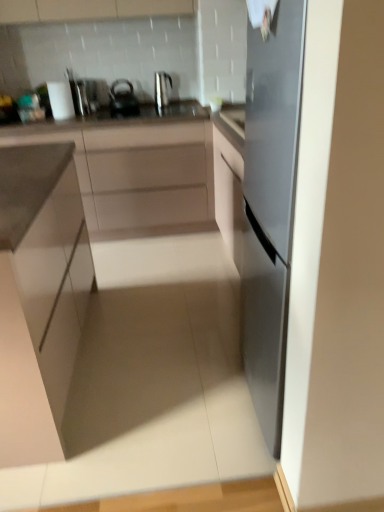
Where is `matte black kettle at upper center`? matte black kettle at upper center is located at coordinates (123, 99).

This screenshot has width=384, height=512. Find the location of `satin silver toaster at upper left`. satin silver toaster at upper left is located at coordinates (78, 95).

Locate an element on the screen. Image resolution: width=384 pixels, height=512 pixels. white matte cabinet at center, which is the second cabinetry in front-to-back order is located at coordinates (136, 172).

Locate an element on the screen. This screenshot has width=384, height=512. metallic silver kettle at upper center is located at coordinates (161, 89).

Is point (80, 170) positioned behind point (67, 68)?

No, (80, 170) is in front of (67, 68).

Is white matte cabinet at center, which is the second cabinetry in front-to-back order, smaller than satin silver toaster at upper left?

Incorrect, white matte cabinet at center, which is the second cabinetry in front-to-back order, is not smaller in size than satin silver toaster at upper left.

Is white matte cabinet at center, which is the first cabinetry from back to front, directly adjacent to satin silver toaster at upper left?

No, white matte cabinet at center, which is the first cabinetry from back to front, is not next to satin silver toaster at upper left.

The width and height of the screenshot is (384, 512). Identify the location of appliance above the white matte cabinet at center, which is the second cabinetry in front-to-back order (from a real-world perspective). point(78,95).

Can you see matte black kettle at upper center touching satin silver toaster at upper left?

matte black kettle at upper center and satin silver toaster at upper left are not in contact.

Between matte black kettle at upper center and satin silver toaster at upper left, which one has smaller width?

satin silver toaster at upper left is thinner.

You are a GUI agent. You are given a task and a screenshot of the screen. Output one action in this format:
    pyautogui.click(x=<x>, y=<y>)
    Task: Click on the appliance that is above the matte black kettle at upper center (from the image's perspective)
    
    Given the screenshot: What is the action you would take?
    pyautogui.click(x=78, y=95)

Is matte black kettle at upper center surrounding satin silver toaster at upper left?

No, satin silver toaster at upper left is not inside matte black kettle at upper center.

Is metallic silver kettle at upper center not inside white matte cabinet at center, which is the second cabinetry in front-to-back order?

metallic silver kettle at upper center lies outside white matte cabinet at center, which is the second cabinetry in front-to-back order,'s area.

Is metallic silver kettle at upper center taller than white matte cabinet at center, which is the second cabinetry in front-to-back order?

Incorrect, the height of metallic silver kettle at upper center is not larger of that of white matte cabinet at center, which is the second cabinetry in front-to-back order.

Which is in front, metallic silver kettle at upper center or white matte cabinet at center, which is the first cabinetry from back to front?

white matte cabinet at center, which is the first cabinetry from back to front, is in front.

From the image's perspective, which is above, metallic silver kettle at upper center or white matte cabinet at center, which is the second cabinetry in front-to-back order?

metallic silver kettle at upper center appears higher in the image.

Is matte white cabinet at left, the 2th cabinetry when ordered from back to front, completely or partially inside satin silver toaster at upper left?

Definitely not — matte white cabinet at left, the 2th cabinetry when ordered from back to front, is not inside satin silver toaster at upper left.

From the image's perspective, is satin silver toaster at upper left on matte white cabinet at left, the 2th cabinetry when ordered from back to front?

Indeed, from the image's perspective, satin silver toaster at upper left is shown above matte white cabinet at left, the 2th cabinetry when ordered from back to front.

How distant is satin silver toaster at upper left from matte white cabinet at left, the 2th cabinetry when ordered from back to front?

satin silver toaster at upper left and matte white cabinet at left, the 2th cabinetry when ordered from back to front, are 5.15 feet apart.

Is satin silver toaster at upper left positioned far away from matte white cabinet at left, the 2th cabinetry when ordered from back to front?

Yes.

Does point (69, 354) come farther from viewer compared to point (155, 72)?

No.

From a real-world perspective, which is physically below, matte white cabinet at left, the 2th cabinetry when ordered from back to front, or metallic silver kettle at upper center?

In real-world perspective, matte white cabinet at left, the 2th cabinetry when ordered from back to front, is lower.

Is matte white cabinet at left, which appears as the 1th cabinetry when viewed from the front, bigger than metallic silver kettle at upper center?

Indeed, matte white cabinet at left, which appears as the 1th cabinetry when viewed from the front, has a larger size compared to metallic silver kettle at upper center.

Would you say metallic silver kettle at upper center is part of matte white cabinet at left, the 2th cabinetry when ordered from back to front,'s contents?

Definitely not — metallic silver kettle at upper center is not inside matte white cabinet at left, the 2th cabinetry when ordered from back to front.

Is white matte cabinet at center, which is the first cabinetry from back to front, facing away from matte black kettle at upper center?

white matte cabinet at center, which is the first cabinetry from back to front, is not turned away from matte black kettle at upper center.

Could you measure the distance between white matte cabinet at center, which is the first cabinetry from back to front, and matte black kettle at upper center?

A distance of 55.62 centimeters exists between white matte cabinet at center, which is the first cabinetry from back to front, and matte black kettle at upper center.

Which of these two, white matte cabinet at center, which is the second cabinetry in front-to-back order, or matte black kettle at upper center, stands taller?

white matte cabinet at center, which is the second cabinetry in front-to-back order.

Considering the sizes of objects white matte cabinet at center, which is the second cabinetry in front-to-back order, and matte black kettle at upper center in the image provided, who is wider, white matte cabinet at center, which is the second cabinetry in front-to-back order, or matte black kettle at upper center?

white matte cabinet at center, which is the second cabinetry in front-to-back order.

Where is `cabinetry behind the matte white cabinet at left, the 2th cabinetry when ordered from back to front`? The height and width of the screenshot is (512, 384). cabinetry behind the matte white cabinet at left, the 2th cabinetry when ordered from back to front is located at coordinates (136, 172).

From a real-world perspective, which object stands above the other?

white matte cabinet at center, which is the second cabinetry in front-to-back order, is physically above.

Is matte white cabinet at left, the 2th cabinetry when ordered from back to front, positioned with its back to white matte cabinet at center, which is the second cabinetry in front-to-back order?

No.

From a real-world perspective, count 1st cabinetrys downward from the satin silver toaster at upper left and point to it. Please provide its 2D coordinates.

[(136, 172)]

Where is `tea pot below the satin silver toaster at upper left (from the image's perspective)`? tea pot below the satin silver toaster at upper left (from the image's perspective) is located at coordinates (123, 99).

Which object lies nearer to the anchor point white matte cabinet at center, which is the first cabinetry from back to front, matte black kettle at upper center or matte white cabinet at left, the 2th cabinetry when ordered from back to front?

Based on the image, matte black kettle at upper center appears to be nearer to white matte cabinet at center, which is the first cabinetry from back to front.

From the image, which object appears to be farther from matte black kettle at upper center, white matte cabinet at center, which is the first cabinetry from back to front, or satin silver toaster at upper left?

Among the two, white matte cabinet at center, which is the first cabinetry from back to front, is located further to matte black kettle at upper center.

From the image, which object appears to be nearer to satin silver toaster at upper left, white matte cabinet at center, which is the first cabinetry from back to front, or matte black kettle at upper center?

matte black kettle at upper center lies closer to satin silver toaster at upper left than the other object.

When comparing their distances from matte white cabinet at left, which appears as the 1th cabinetry when viewed from the front, does satin silver toaster at upper left or white matte cabinet at center, which is the second cabinetry in front-to-back order, seem further?

satin silver toaster at upper left lies further to matte white cabinet at left, which appears as the 1th cabinetry when viewed from the front, than the other object.

When comparing their distances from metallic silver kettle at upper center, does white matte cabinet at center, which is the second cabinetry in front-to-back order, or matte white cabinet at left, the 2th cabinetry when ordered from back to front, seem further?

matte white cabinet at left, the 2th cabinetry when ordered from back to front, is further to metallic silver kettle at upper center.

Based on their spatial positions, is white matte cabinet at center, which is the first cabinetry from back to front, or metallic silver kettle at upper center further from matte black kettle at upper center?

white matte cabinet at center, which is the first cabinetry from back to front.

Based on their spatial positions, is metallic silver kettle at upper center or matte black kettle at upper center closer to white matte cabinet at center, which is the second cabinetry in front-to-back order?

Among the two, matte black kettle at upper center is located nearer to white matte cabinet at center, which is the second cabinetry in front-to-back order.

In the scene shown: Which object lies nearer to the anchor point matte black kettle at upper center, satin silver toaster at upper left or matte white cabinet at left, which appears as the 1th cabinetry when viewed from the front?

The object closer to matte black kettle at upper center is satin silver toaster at upper left.

At what (x,y) coordinates should I click in order to perform the action: click on cabinetry positioned between matte white cabinet at left, which appears as the 1th cabinetry when viewed from the front, and metallic silver kettle at upper center from near to far. Please return your answer as a coordinate pair (x, y). The height and width of the screenshot is (512, 384). Looking at the image, I should click on (136, 172).

Locate an element on the screen. Image resolution: width=384 pixels, height=512 pixels. cabinetry between matte white cabinet at left, which appears as the 1th cabinetry when viewed from the front, and satin silver toaster at upper left in the front-back direction is located at coordinates (136, 172).

Identify the location of tea pot between satin silver toaster at upper left and white matte cabinet at center, which is the second cabinetry in front-to-back order, in the up-down direction. (123, 99).

This screenshot has width=384, height=512. Find the location of `appliance positioned between matte white cabinet at left, which appears as the 1th cabinetry when viewed from the front, and metallic silver kettle at upper center from near to far`. appliance positioned between matte white cabinet at left, which appears as the 1th cabinetry when viewed from the front, and metallic silver kettle at upper center from near to far is located at coordinates (78, 95).